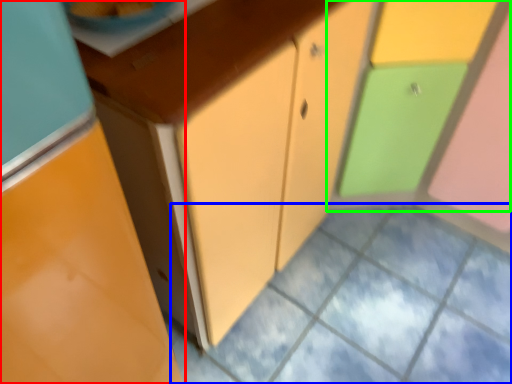
Question: Considering the real-world distances, which object is closest to cabinetry (highlighted by a red box)? square (highlighted by a blue box) or cabinetry (highlighted by a green box).

Choices:
 (A) square
 (B) cabinetry

Answer: (A)